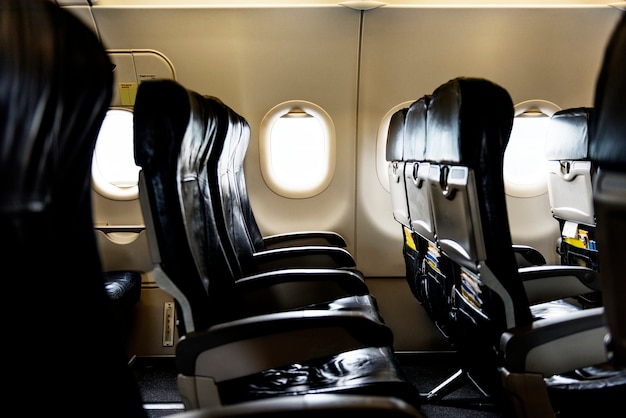
The height and width of the screenshot is (418, 626). I want to click on seats, so click(x=52, y=244), click(x=165, y=201), click(x=228, y=171), click(x=244, y=175), click(x=462, y=148), click(x=419, y=143), click(x=401, y=137), click(x=575, y=136), click(x=611, y=141).